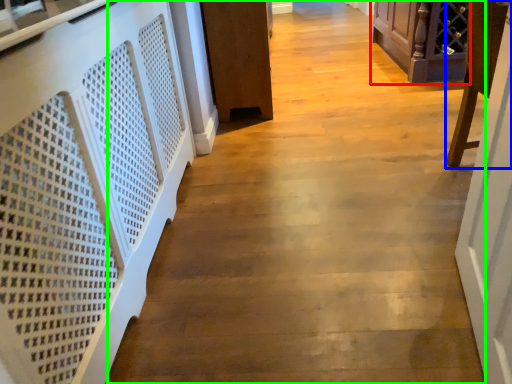
Question: Which is farther away from furniture (highlighted by a red box)? furniture (highlighted by a blue box) or path (highlighted by a green box)?

Choices:
 (A) furniture
 (B) path

Answer: (A)